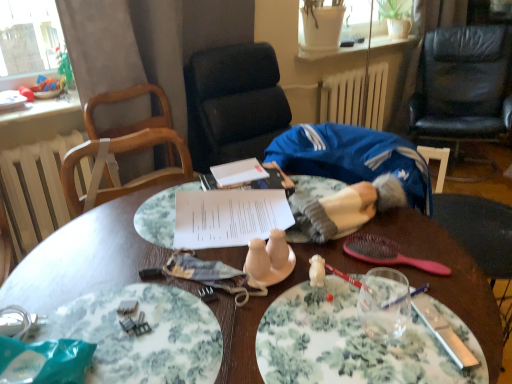
Find the location of `vacant space to the left of silver metallic knife at lower right`. vacant space to the left of silver metallic knife at lower right is located at coordinates (350, 330).